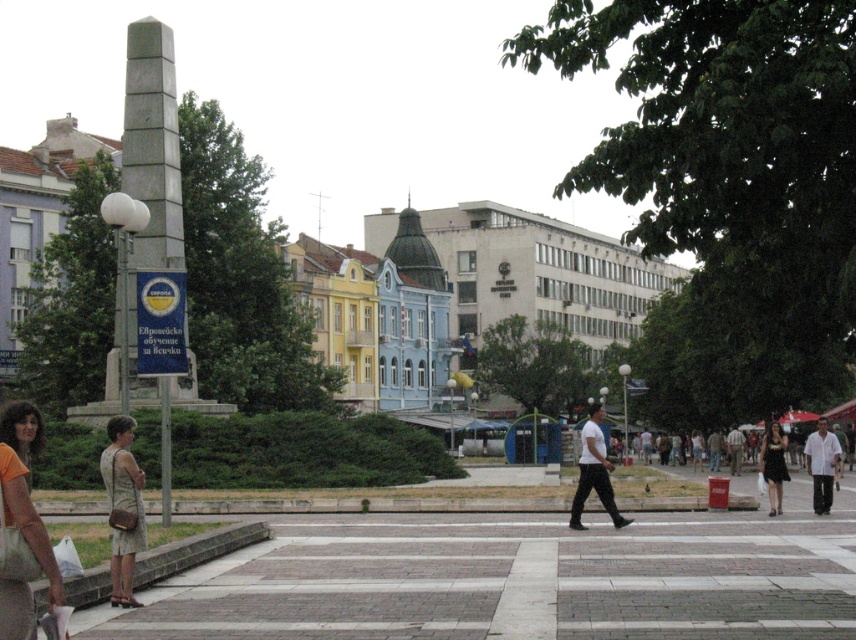
Question: From the image, what is the correct spatial relationship of white cotton shirt at right in relation to black dress at lower right?

Choices:
 (A) right
 (B) left

Answer: (A)

Question: Does white matte shirt at center lie in front of white cotton shirt at right?

Choices:
 (A) no
 (B) yes

Answer: (B)

Question: Which of these objects is positioned closest to the white concrete pavement at center?

Choices:
 (A) white cotton shirt at right
 (B) white matte shirt at center
 (C) black dress at lower right
 (D) orange cotton shirt at lower left

Answer: (B)

Question: Is beige textured dress at lower left below black dress at lower right?

Choices:
 (A) no
 (B) yes

Answer: (A)

Question: Which of these objects is positioned farthest from the white concrete pavement at center?

Choices:
 (A) beige textured dress at lower left
 (B) orange cotton shirt at lower left
 (C) white matte shirt at center

Answer: (B)

Question: Estimate the real-world distances between objects in this image. Which object is farther from the beige textured dress at lower left?

Choices:
 (A) orange cotton shirt at lower left
 (B) black dress at lower right
 (C) white matte shirt at center
 (D) white cotton shirt at right

Answer: (B)